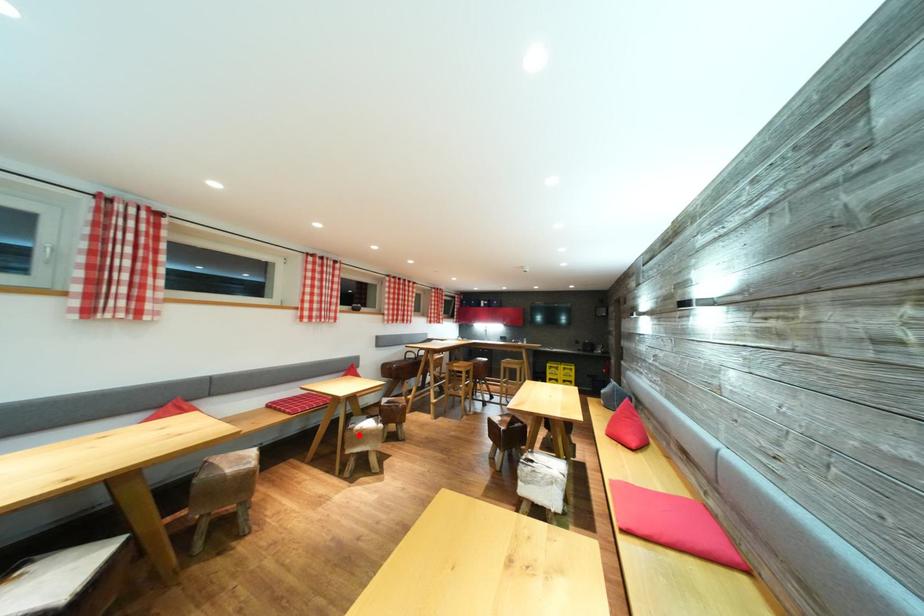
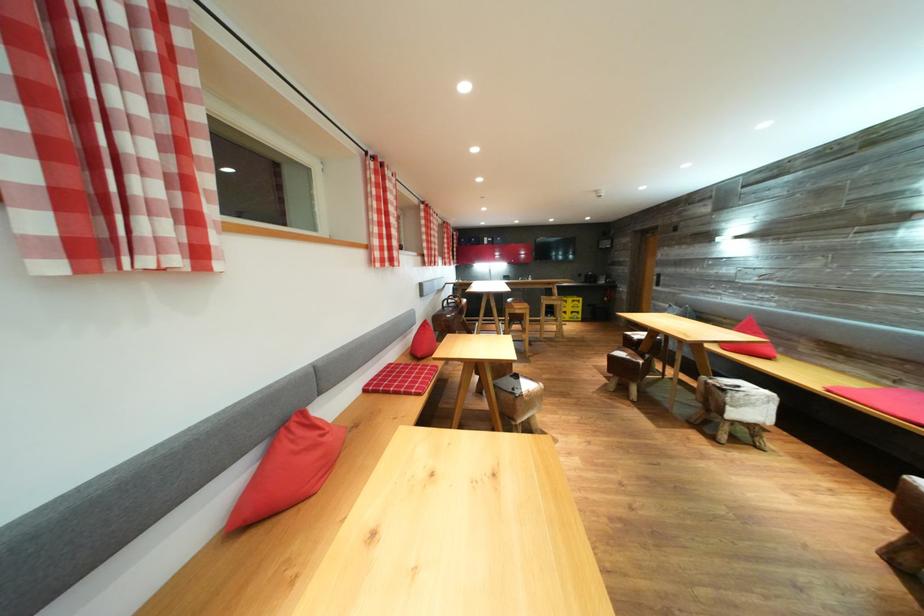
Question: I am providing you with two images of the same scene from different viewpoints. In image1, a red point is highlighted. Considering the same 3D point in image2, which of the following is correct?

Choices:
 (A) It is closer
 (B) It is farther

Answer: (B)